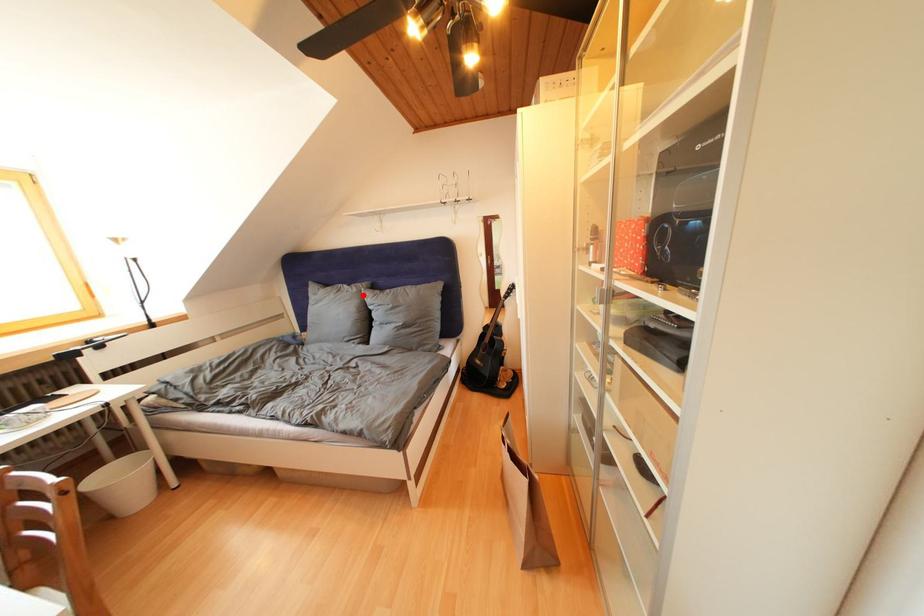
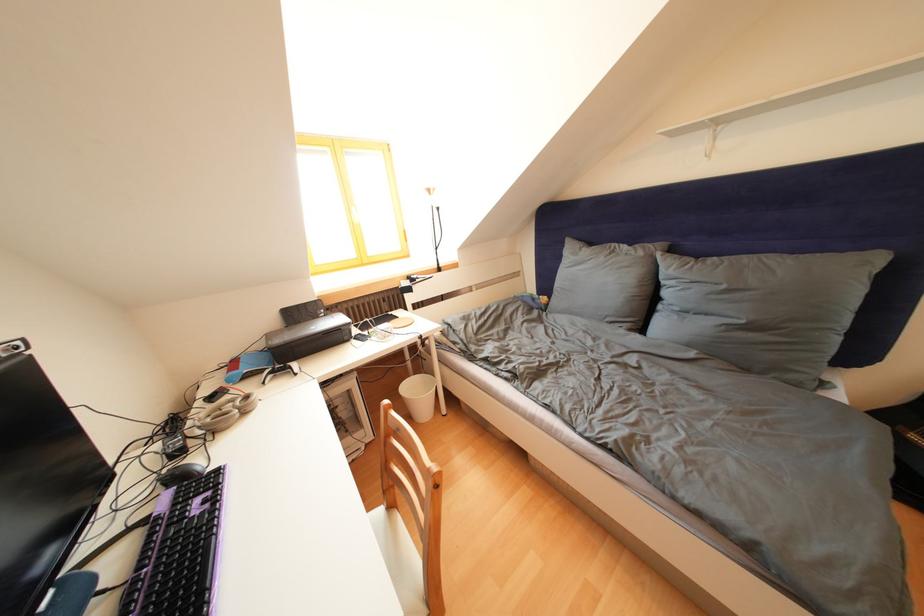
Find the pixel in the second image that matches the highlighted location in the first image.

(649, 259)